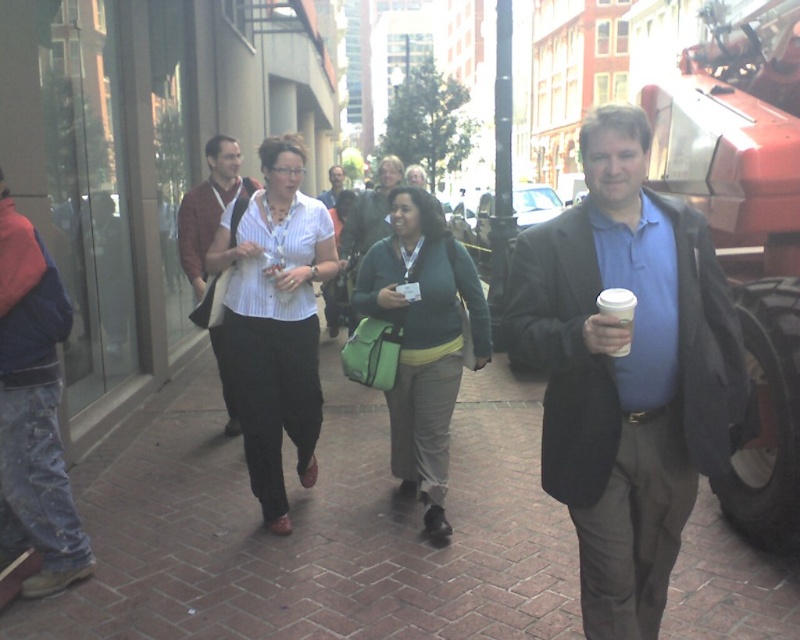
Does green fabric bag at center have a greater height compared to matte brown jacket at center?

Yes.

Can you confirm if green fabric bag at center is thinner than matte brown jacket at center?

No.

Where is `green fabric bag at center`? The height and width of the screenshot is (640, 800). green fabric bag at center is located at coordinates (424, 339).

The height and width of the screenshot is (640, 800). Identify the location of green fabric bag at center. (424, 339).

Can you confirm if brick pavement at center is positioned to the left of matte brown jacket at center?

Incorrect, brick pavement at center is not on the left side of matte brown jacket at center.

Which of these two, brick pavement at center or matte brown jacket at center, stands taller?

matte brown jacket at center

Is point (501, 504) in front of point (208, 177)?

Yes, point (501, 504) is in front of point (208, 177).

Locate an element on the screen. brick pavement at center is located at coordinates (316, 529).

Who is more distant from viewer, (x=124, y=531) or (x=241, y=353)?

The point (x=124, y=531) is more distant.

Does brick pavement at center have a lesser height compared to white striped shirt at center?

Correct, brick pavement at center is not as tall as white striped shirt at center.

Locate an element on the screen. brick pavement at center is located at coordinates (316, 529).